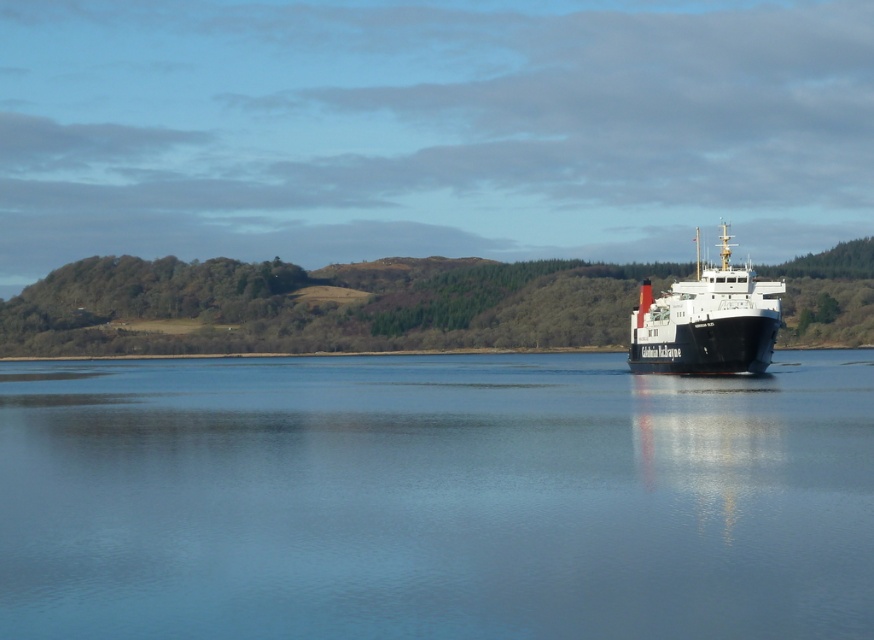
You are a photographer trying to capture the ferry boat and the surrounding water. Based on the scene, which object, the blue water at center or the black matte ship at right, will occupy more of the photo frame?

The black matte ship at right occupies more of the photo frame since it is larger than the blue water at center according to the description.

You are standing on the deck of the ferry and looking out towards the horizon. There are two points marked on the water surface in front of you. The first point is at coordinates point (x=400, y=454) and the second point is at coordinates point (x=649, y=368). Which point is closer to you?

Point (x=400, y=454) is closer to the viewer than point (x=649, y=368).

From the picture: You are standing on the deck of the black matte ship at right and want to look towards the blue water at center. Which direction should you face?

You should face to the left to look towards the blue water at center since it is located to the left of the black matte ship at right.